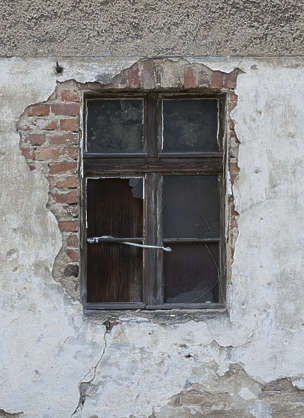
Identify the location of white plaster. (291, 186), (39, 317).